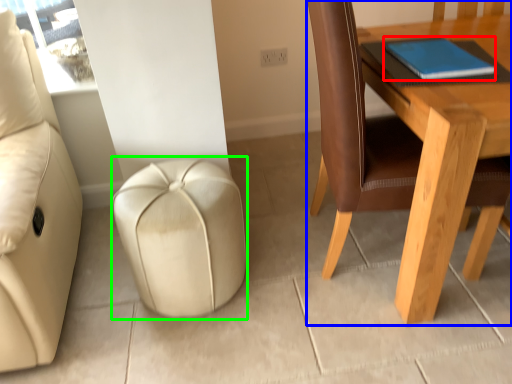
Question: Which object is the farthest from notebook (highlighted by a red box)? Choose among these: table (highlighted by a blue box) or stool (highlighted by a green box).

Choices:
 (A) table
 (B) stool

Answer: (B)